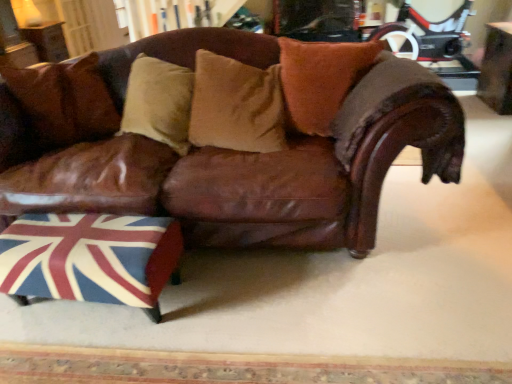
Question: Considering the relative sizes of union jack fabric ottoman at lower left and brown leather couch at center in the image provided, is union jack fabric ottoman at lower left smaller than brown leather couch at center?

Choices:
 (A) no
 (B) yes

Answer: (B)

Question: Is brown leather couch at center at the back of union jack fabric ottoman at lower left?

Choices:
 (A) no
 (B) yes

Answer: (B)

Question: From a real-world perspective, is union jack fabric ottoman at lower left below brown leather couch at center?

Choices:
 (A) yes
 (B) no

Answer: (A)

Question: Is union jack fabric ottoman at lower left not inside brown leather couch at center?

Choices:
 (A) yes
 (B) no

Answer: (A)

Question: Is the surface of union jack fabric ottoman at lower left in direct contact with brown leather couch at center?

Choices:
 (A) no
 (B) yes

Answer: (A)

Question: Considering the relative positions of union jack fabric ottoman at lower left and brown leather couch at center in the image provided, is union jack fabric ottoman at lower left in front of brown leather couch at center?

Choices:
 (A) no
 (B) yes

Answer: (A)

Question: Is wooden table at upper right, marked as the 2th table in a left-to-right arrangement, facing away from brown leather couch at center?

Choices:
 (A) no
 (B) yes

Answer: (A)

Question: Considering the relative sizes of wooden table at upper right, which is counted as the first table, starting from the bottom, and brown leather couch at center in the image provided, is wooden table at upper right, which is counted as the first table, starting from the bottom, shorter than brown leather couch at center?

Choices:
 (A) yes
 (B) no

Answer: (A)

Question: Does wooden table at upper right, the 2th table positioned from the top, have a greater height compared to brown leather couch at center?

Choices:
 (A) no
 (B) yes

Answer: (A)

Question: Is wooden table at upper right, marked as the 2th table in a left-to-right arrangement, smaller than brown leather couch at center?

Choices:
 (A) yes
 (B) no

Answer: (A)

Question: Is brown leather couch at center surrounded by wooden table at upper right, the 2th table positioned from the top?

Choices:
 (A) yes
 (B) no

Answer: (B)

Question: Is wooden table at upper right, which ranks as the 1th table in right-to-left order, further to camera compared to brown leather couch at center?

Choices:
 (A) no
 (B) yes

Answer: (B)

Question: From a real-world perspective, is wooden table at upper left, which is the first table from back to front, beneath wooden table at upper right, the 2th table from the back?

Choices:
 (A) yes
 (B) no

Answer: (B)